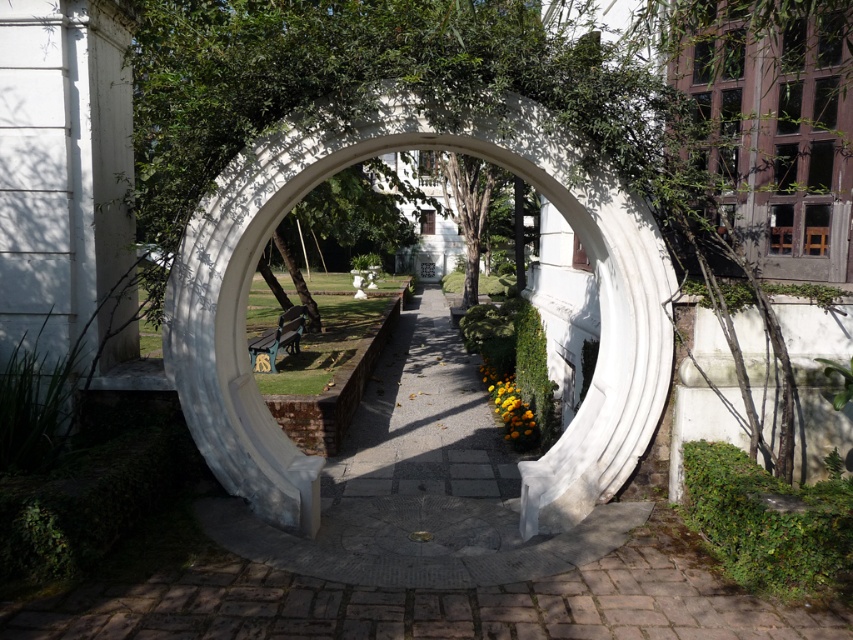
You are standing in the garden and want to walk through the white stone archway at center. Which direction should you go relative to the white stone path at center?

The white stone path at center is to the right of the white stone archway at center, so to walk through the white stone archway at center, you should go to the left of the white stone path at center.

Based on the photo, you are standing in the garden and want to walk through the archway. Which object, the white stone path at center or the white stone archway at center, will you step onto first?

You will step onto the white stone path at center first because it is bigger than the white stone archway at center, meaning it extends further forward towards you.